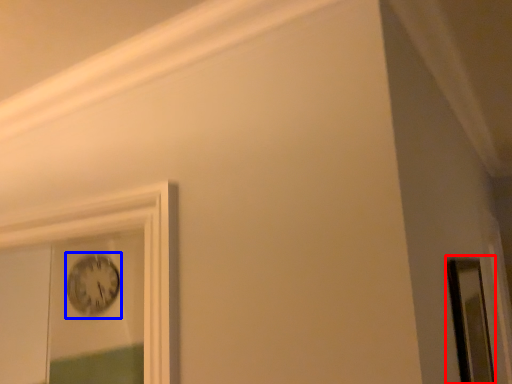
Question: Which point is closer to the camera, mirror (highlighted by a red box) or clock (highlighted by a blue box)?

Choices:
 (A) mirror
 (B) clock

Answer: (A)